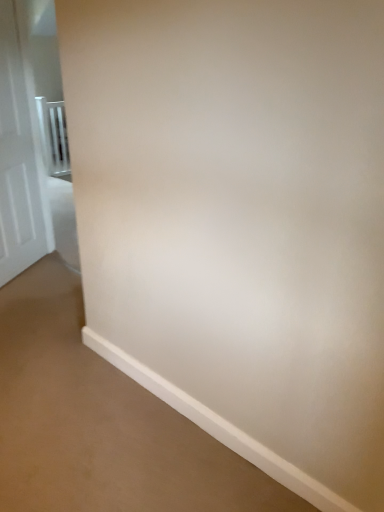
You are a GUI agent. You are given a task and a screenshot of the screen. Output one action in this format:
    pyautogui.click(x=<x>, y=<y>)
    Task: Click on the metallic silver balustrade at left
    The width and height of the screenshot is (384, 512).
    Given the screenshot: What is the action you would take?
    pyautogui.click(x=54, y=137)

In order to face metallic silver balustrade at left, should I rotate leftwards or rightwards?

Rotate your view left by about 17.777°.

Measure the distance between metallic silver balustrade at left and camera.

The distance of metallic silver balustrade at left from camera is 4.77 meters.

What is the approximate height of metallic silver balustrade at left?

It is 3.37 feet.

What do you see at coordinates (54, 137) in the screenshot? I see `metallic silver balustrade at left` at bounding box center [54, 137].

I want to click on white glossy door at left, so click(x=20, y=153).

This screenshot has width=384, height=512. What do you see at coordinates (20, 153) in the screenshot?
I see `white glossy door at left` at bounding box center [20, 153].

Identify the location of metallic silver balustrade at left. (54, 137).

Between white glossy door at left and metallic silver balustrade at left, which one appears on the right side from the viewer's perspective?

white glossy door at left.

Is white glossy door at left further to camera compared to metallic silver balustrade at left?

No, it is not.

Between point (3, 274) and point (51, 106), which one is positioned behind?

Point (51, 106)

From the image's perspective, is white glossy door at left above or below metallic silver balustrade at left?

From the image's perspective, white glossy door at left appears below metallic silver balustrade at left.

From a real-world perspective, between white glossy door at left and metallic silver balustrade at left, who is vertically lower?

metallic silver balustrade at left, from a real-world perspective.

Which object is thinner, white glossy door at left or metallic silver balustrade at left?

white glossy door at left.

Who is taller, white glossy door at left or metallic silver balustrade at left?

Standing taller between the two is white glossy door at left.

Considering the relative sizes of white glossy door at left and metallic silver balustrade at left in the image provided, is white glossy door at left smaller than metallic silver balustrade at left?

No, white glossy door at left is not smaller than metallic silver balustrade at left.

Choose the correct answer: Is white glossy door at left inside metallic silver balustrade at left or outside it?

The correct answer is: outside.

Is white glossy door at left far away from metallic silver balustrade at left?

Yes, white glossy door at left and metallic silver balustrade at left are located far from each other.

Is white glossy door at left facing towards metallic silver balustrade at left?

No, white glossy door at left does not turn towards metallic silver balustrade at left.

How distant is white glossy door at left from metallic silver balustrade at left?

They are 5.77 feet apart.

The width and height of the screenshot is (384, 512). Find the location of `door located above the metallic silver balustrade at left (from a real-world perspective)`. door located above the metallic silver balustrade at left (from a real-world perspective) is located at coordinates (20, 153).

Would you say metallic silver balustrade at left is to the left or to the right of white glossy door at left in the picture?

metallic silver balustrade at left is to the left of white glossy door at left.

Considering their positions, is metallic silver balustrade at left located in front of or behind white glossy door at left?

metallic silver balustrade at left is positioned farther from the viewer than white glossy door at left.

Which is farther, (x=62, y=167) or (x=11, y=152)?

Point (x=62, y=167)

From the image's perspective, is metallic silver balustrade at left over white glossy door at left?

Yes, from the image's perspective, metallic silver balustrade at left is on top of white glossy door at left.

From a real-world perspective, is metallic silver balustrade at left positioned above or below white glossy door at left?

In terms of real-world spatial position, metallic silver balustrade at left is below white glossy door at left.

Considering the sizes of objects metallic silver balustrade at left and white glossy door at left in the image provided, who is wider, metallic silver balustrade at left or white glossy door at left?

With larger width is metallic silver balustrade at left.

Considering the relative sizes of metallic silver balustrade at left and white glossy door at left in the image provided, is metallic silver balustrade at left taller than white glossy door at left?

In fact, metallic silver balustrade at left may be shorter than white glossy door at left.

Considering the sizes of objects metallic silver balustrade at left and white glossy door at left in the image provided, who is smaller, metallic silver balustrade at left or white glossy door at left?

metallic silver balustrade at left is smaller.

In the scene shown: Which is correct: metallic silver balustrade at left is inside white glossy door at left, or outside of it?

metallic silver balustrade at left cannot be found inside white glossy door at left.

Is the surface of metallic silver balustrade at left in direct contact with white glossy door at left?

They are not placed beside each other.

In the scene shown: Is metallic silver balustrade at left oriented towards white glossy door at left?

No, metallic silver balustrade at left is not facing towards white glossy door at left.

Can you tell me how much metallic silver balustrade at left and white glossy door at left differ in facing direction?

The angular difference between metallic silver balustrade at left and white glossy door at left is 22.8 degrees.

How distant is metallic silver balustrade at left from white glossy door at left?

They are 1.76 meters apart.

Image resolution: width=384 pixels, height=512 pixels. I want to click on door that is above the metallic silver balustrade at left (from a real-world perspective), so click(20, 153).

At what (x,y) coordinates should I click in order to perform the action: click on balustrade that is under the white glossy door at left (from a real-world perspective). Please return your answer as a coordinate pair (x, y). Looking at the image, I should click on (54, 137).

Image resolution: width=384 pixels, height=512 pixels. Identify the location of balustrade behind the white glossy door at left. (54, 137).